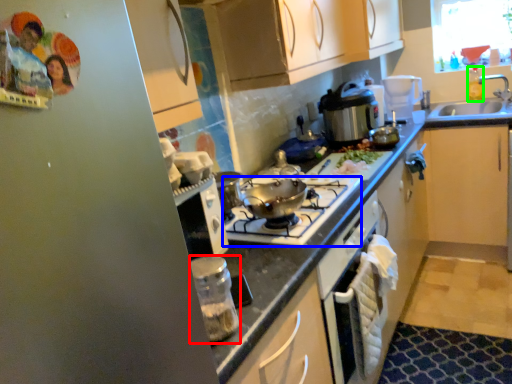
Question: Which object is the farthest from kitchen appliance (highlighted by a red box)? Choose among these: gas stove (highlighted by a blue box) or bottle (highlighted by a green box).

Choices:
 (A) gas stove
 (B) bottle

Answer: (B)